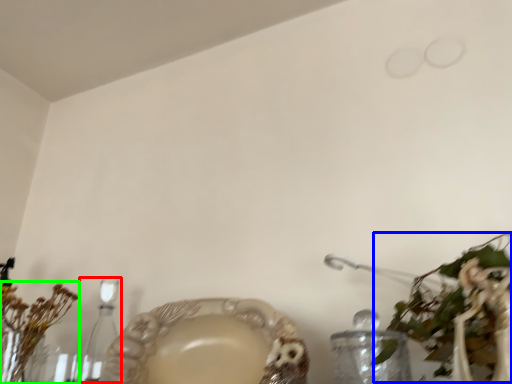
Question: Which object is positioned farthest from candle holder (highlighted by a red box)? Select from floral arrangement (highlighted by a blue box) and floral arrangement (highlighted by a green box).

Choices:
 (A) floral arrangement
 (B) floral arrangement

Answer: (A)